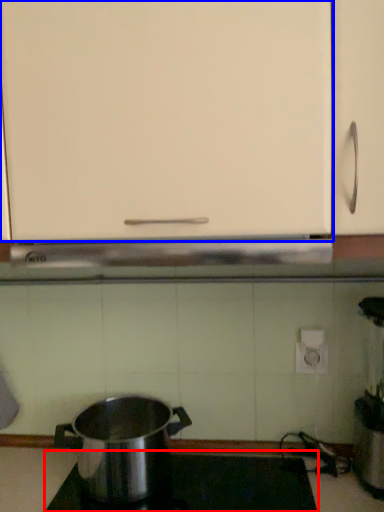
Question: Which object is further to the camera taking this photo, gas stove (highlighted by a red box) or cabinetry (highlighted by a blue box)?

Choices:
 (A) gas stove
 (B) cabinetry

Answer: (A)